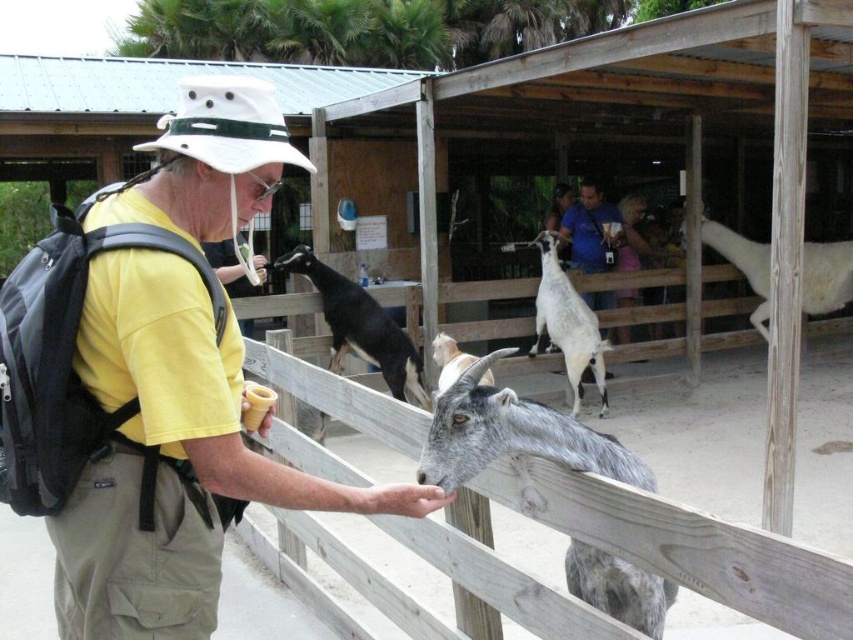
Question: In this image, where is black glossy goat at center located relative to white woolen goat at center?

Choices:
 (A) right
 (B) left

Answer: (B)

Question: Can you confirm if black glossy goat at center is wider than white woolen goat at center?

Choices:
 (A) no
 (B) yes

Answer: (B)

Question: Considering the real-world distances, which object is closest to the gray woolen goat at center?

Choices:
 (A) white woolen goat at upper right
 (B) yellow cotton shirt at center
 (C) wooden fence at center
 (D) black glossy goat at center

Answer: (C)

Question: Which of these objects is positioned farthest from the white woolen goat at upper right?

Choices:
 (A) gray woolen goat at center
 (B) black glossy goat at center
 (C) yellow cotton shirt at center

Answer: (C)

Question: Estimate the real-world distances between objects in this image. Which object is farther from the white woolen goat at upper right?

Choices:
 (A) wooden fence at center
 (B) black glossy goat at center
 (C) gray woolen goat at center

Answer: (C)

Question: Is yellow cotton shirt at center positioned behind white woolen goat at center?

Choices:
 (A) yes
 (B) no

Answer: (B)